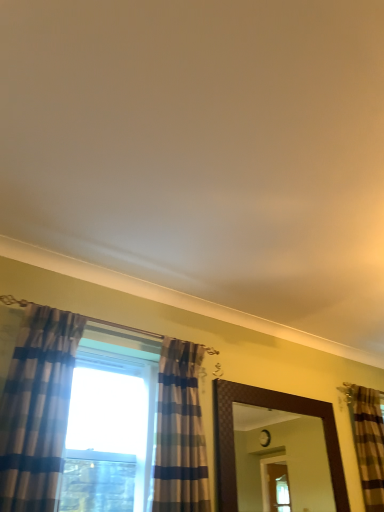
Question: Can you confirm if brown textured mirror at center is smaller than brown striped curtain at right, the 1th curtain when ordered from right to left?

Choices:
 (A) no
 (B) yes

Answer: (A)

Question: From a real-world perspective, is brown textured mirror at center under brown striped curtain at right, the 1th curtain in the back-to-front sequence?

Choices:
 (A) no
 (B) yes

Answer: (B)

Question: Is brown textured mirror at center aimed at brown striped curtain at right, positioned as the 3th curtain in left-to-right order?

Choices:
 (A) no
 (B) yes

Answer: (A)

Question: From a real-world perspective, is brown textured mirror at center positioned over brown striped curtain at right, positioned as the 3th curtain in left-to-right order, based on gravity?

Choices:
 (A) no
 (B) yes

Answer: (A)

Question: From the image's perspective, is brown textured mirror at center located above brown striped curtain at right, the 1th curtain when ordered from right to left?

Choices:
 (A) no
 (B) yes

Answer: (B)

Question: Does brown textured mirror at center appear on the left side of brown striped curtain at right, the 1th curtain in the back-to-front sequence?

Choices:
 (A) yes
 (B) no

Answer: (A)

Question: Is striped fabric curtain at center, the 2th curtain viewed from the right, further to camera compared to brown striped curtain at right, which appears as the third curtain when viewed from the front?

Choices:
 (A) yes
 (B) no

Answer: (B)

Question: Does striped fabric curtain at center, placed as the 2th curtain when sorted from front to back, have a larger size compared to brown striped curtain at right, positioned as the 3th curtain in left-to-right order?

Choices:
 (A) no
 (B) yes

Answer: (B)

Question: Is striped fabric curtain at center, which appears as the 2th curtain when viewed from the back, at the right side of brown striped curtain at right, positioned as the 3th curtain in left-to-right order?

Choices:
 (A) yes
 (B) no

Answer: (B)

Question: Considering the relative sizes of striped fabric curtain at center, which is the 2th curtain from left to right, and brown striped curtain at right, which appears as the third curtain when viewed from the front, in the image provided, is striped fabric curtain at center, which is the 2th curtain from left to right, thinner than brown striped curtain at right, which appears as the third curtain when viewed from the front,?

Choices:
 (A) yes
 (B) no

Answer: (B)

Question: Does striped fabric curtain at center, which appears as the 2th curtain when viewed from the back, touch brown striped curtain at right, the 1th curtain when ordered from right to left?

Choices:
 (A) no
 (B) yes

Answer: (A)

Question: Is striped fabric curtain at center, the 2th curtain viewed from the right, oriented towards brown striped curtain at right, the 1th curtain when ordered from right to left?

Choices:
 (A) yes
 (B) no

Answer: (B)

Question: Considering the relative sizes of brown textured mirror at center and plaid fabric curtain at left, marked as the 3th curtain in a back-to-front arrangement, in the image provided, is brown textured mirror at center bigger than plaid fabric curtain at left, marked as the 3th curtain in a back-to-front arrangement,?

Choices:
 (A) no
 (B) yes

Answer: (A)